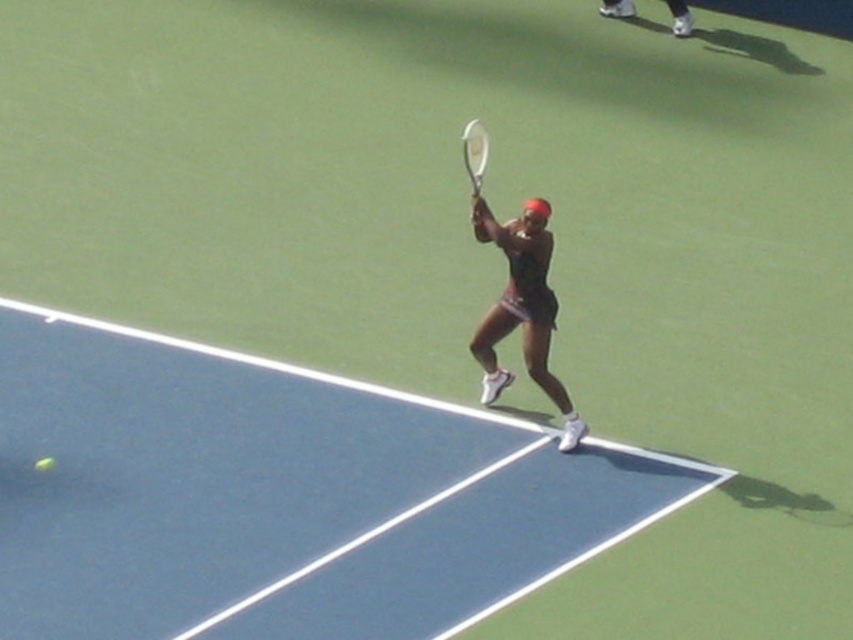
Question: Is blue rubber tennis court at center to the left of black matte tennis racket at center from the viewer's perspective?

Choices:
 (A) yes
 (B) no

Answer: (A)

Question: Which is nearer to the blue rubber tennis court at center?

Choices:
 (A) white metallic tennis racket at center
 (B) black matte tennis racket at center

Answer: (B)

Question: Which of these objects is positioned farthest from the blue rubber tennis court at center?

Choices:
 (A) white metallic tennis racket at center
 (B) black matte tennis racket at center

Answer: (A)

Question: Which point appears closest to the camera in this image?

Choices:
 (A) (479, 164)
 (B) (521, 243)
 (C) (196, 381)

Answer: (B)

Question: Can you confirm if blue rubber tennis court at center is positioned above black matte tennis racket at center?

Choices:
 (A) no
 (B) yes

Answer: (A)

Question: Does blue rubber tennis court at center appear on the right side of white metallic tennis racket at center?

Choices:
 (A) yes
 (B) no

Answer: (B)